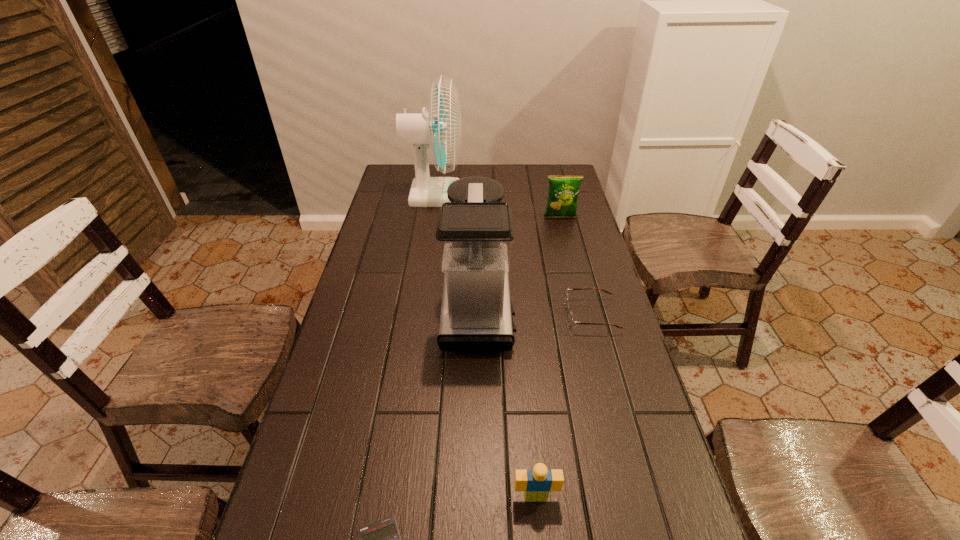
The width and height of the screenshot is (960, 540). What are the coordinates of `free space between the coffee maker and the Lego` in the screenshot? It's located at (507, 402).

I want to click on free space between the spectacles and the fifth shortest object, so click(x=534, y=312).

I want to click on free space between the spectacles and the second tallest object, so click(x=534, y=312).

Where is `vacant region between the fourth shortest object and the second nearest object`? vacant region between the fourth shortest object and the second nearest object is located at coordinates (548, 357).

This screenshot has width=960, height=540. I want to click on the closest object to the spectacles, so click(x=475, y=234).

Point out which object is positioned as the third nearest to the crisp (potato chip). Please provide its 2D coordinates. Your answer should be formatted as a tuple, i.e. [(x, y)], where the tuple contains the x and y coordinates of a point satisfying the conditions above.

[(571, 321)]

Image resolution: width=960 pixels, height=540 pixels. In order to click on vacant position in the image that satisfies the following two spatial constraints: 1. on the front-facing side of the crisp (potato chip); 2. at the front of the fifth shortest object where the controls are located in this screenshot , I will do `click(583, 308)`.